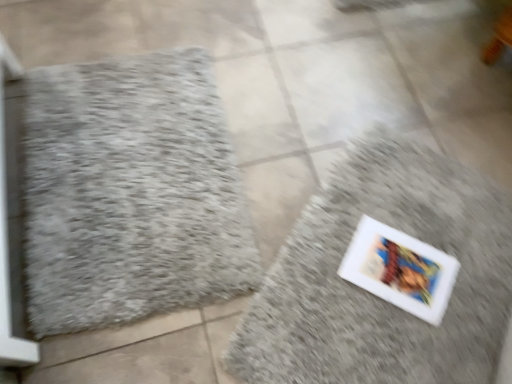
Find the location of a particular element. This screenshot has height=384, width=512. blank space situated above white matte book at lower right, the first bath mat from the right (from a real-world perspective) is located at coordinates (398, 265).